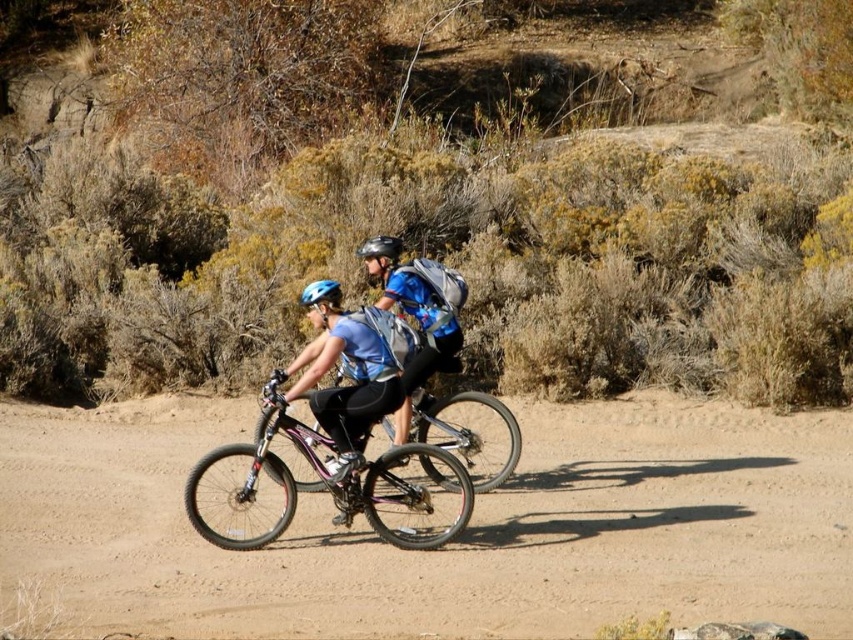
Between shiny purple bicycle at center and matte blue helmet at center, which one has more height?

matte blue helmet at center

Is point (202, 516) positioned behind point (399, 349)?

Yes, it is behind point (399, 349).

Is point (265, 449) farther from camera compared to point (332, 429)?

No, (265, 449) is closer to viewer.

The image size is (853, 640). I want to click on shiny purple bicycle at center, so click(x=325, y=483).

Can you confirm if shiny purple bicycle at center is thinner than blue matte helmet at center?

No.

Is shiny purple bicycle at center closer to the viewer compared to blue matte helmet at center?

Yes.

Who is more forward, (212, 465) or (312, 301)?

Point (212, 465) is more forward.

The height and width of the screenshot is (640, 853). In order to click on shiny purple bicycle at center in this screenshot , I will do `click(325, 483)`.

Measure the distance between shiny purple bicycle at center and metallic reflective helmet at center.

shiny purple bicycle at center is 1.53 meters away from metallic reflective helmet at center.

Based on the photo, is shiny purple bicycle at center shorter than metallic reflective helmet at center?

No, shiny purple bicycle at center is not shorter than metallic reflective helmet at center.

Is point (291, 509) closer to camera compared to point (384, 236)?

That is True.

Locate an element on the screen. The width and height of the screenshot is (853, 640). shiny purple bicycle at center is located at coordinates (325, 483).